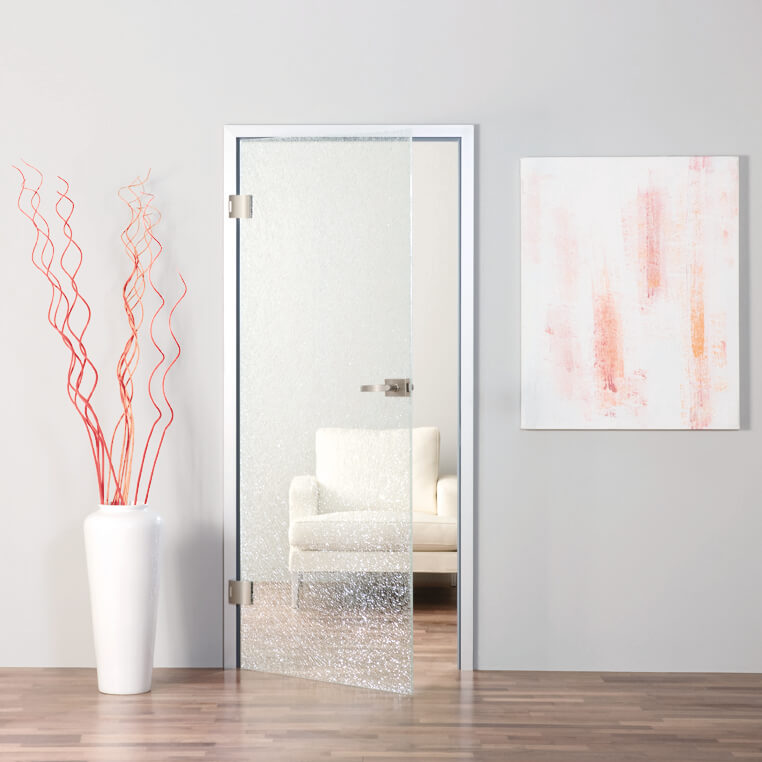
Locate an element on the screen. The height and width of the screenshot is (762, 762). vase is located at coordinates (106, 639).